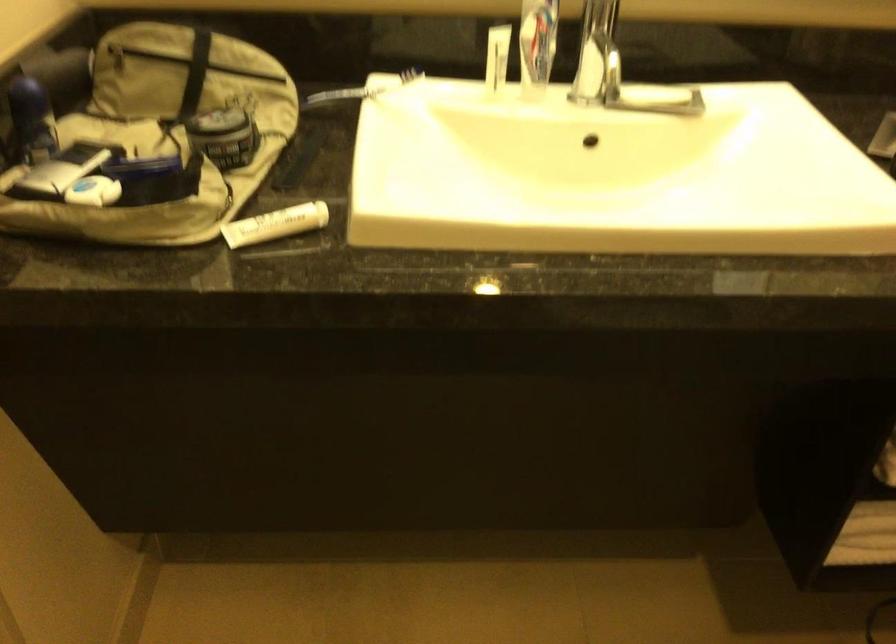
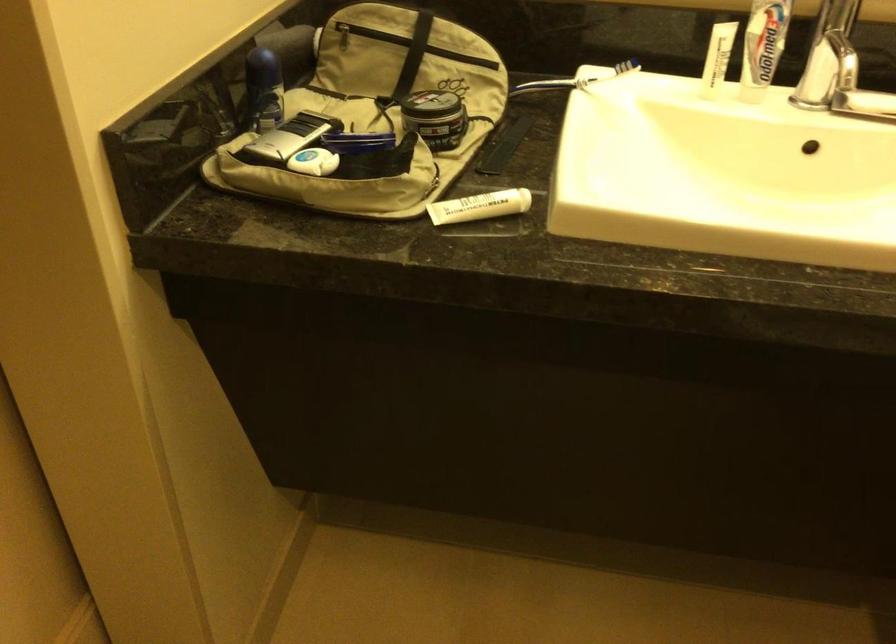
Where in the second image is the point corresponding to (x=273, y=225) from the first image?

(479, 205)